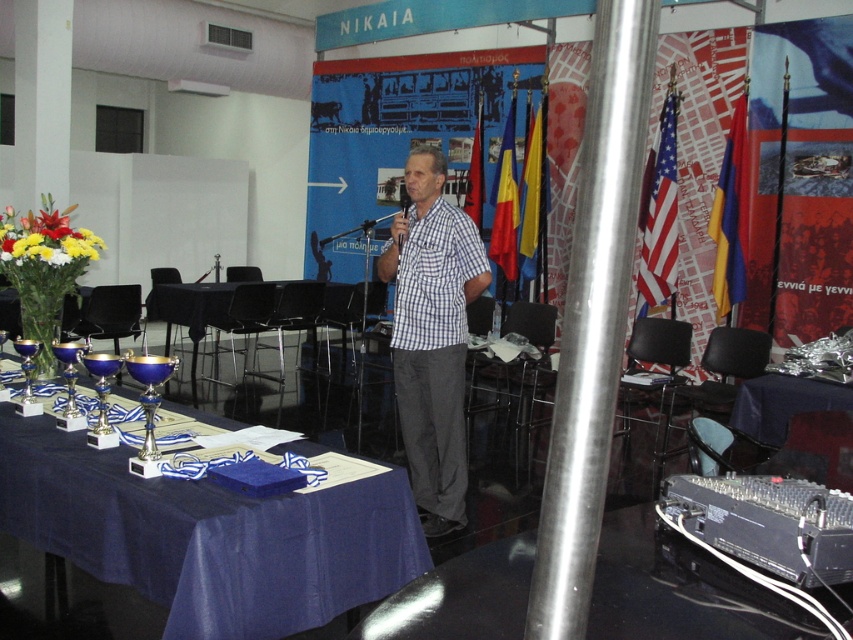
Question: Does blue fabric table at center appear on the right side of black plastic microphone at center?

Choices:
 (A) no
 (B) yes

Answer: (A)

Question: Which of these objects is positioned farthest from the black plastic microphone at center?

Choices:
 (A) white checkered shirt at center
 (B) vibrant floral bouquet at left
 (C) blue fabric table at lower right
 (D) blue fabric table at center

Answer: (C)

Question: Can you confirm if blue fabric table at lower right is positioned to the left of black plastic microphone at center?

Choices:
 (A) no
 (B) yes

Answer: (A)

Question: Is blue fabric table at center bigger than blue fabric table at lower right?

Choices:
 (A) yes
 (B) no

Answer: (A)

Question: Which of the following is the closest to the observer?

Choices:
 (A) pyautogui.click(x=839, y=394)
 (B) pyautogui.click(x=64, y=264)
 (C) pyautogui.click(x=402, y=202)

Answer: (B)

Question: Which object is the closest to the white checkered shirt at center?

Choices:
 (A) vibrant floral bouquet at left
 (B) blue fabric table at lower right
 (C) blue fabric table at center

Answer: (B)